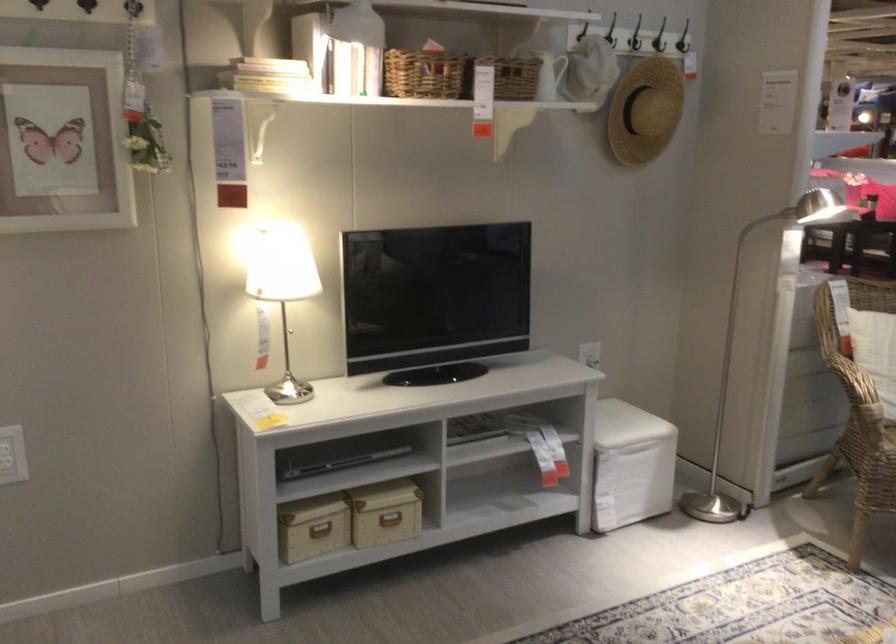
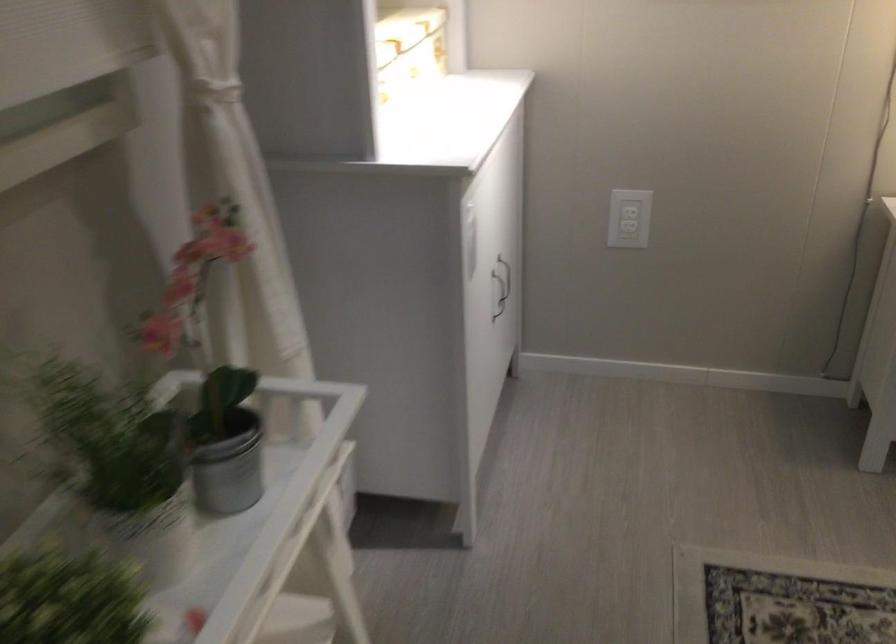
The first image is from the beginning of the video and the second image is from the end. How did the camera likely rotate when shooting the video?

The rotation direction of the camera is left-down.